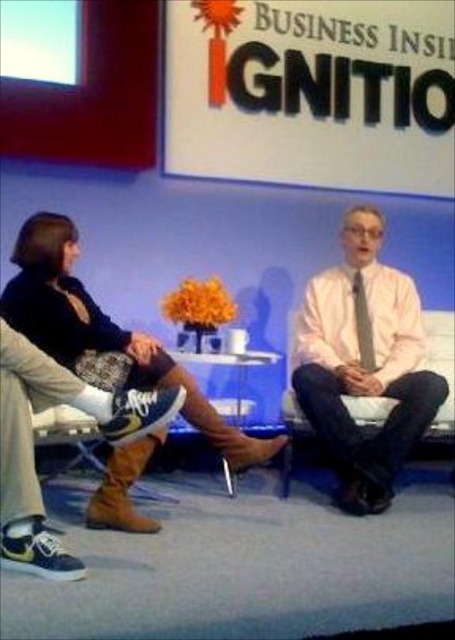
Does pink satin shirt at center appear on the right side of brown suede boots at lower center?

Correct, you'll find pink satin shirt at center to the right of brown suede boots at lower center.

Locate an element on the screen. The height and width of the screenshot is (640, 455). pink satin shirt at center is located at coordinates (364, 364).

Is point (80, 396) less distant than point (365, 355)?

Yes, it is in front of point (365, 355).

Is brown suede boot at lower left wider than silky white tie at center?

Correct, the width of brown suede boot at lower left exceeds that of silky white tie at center.

Between point (64, 554) and point (358, 346), which one is positioned behind?

Point (358, 346)

Identify the location of brown suede boot at lower left. The image size is (455, 640). (34, 451).

The image size is (455, 640). What do you see at coordinates (364, 364) in the screenshot?
I see `pink satin shirt at center` at bounding box center [364, 364].

Is pink satin shirt at center to the right of brown suede boot at lower left from the viewer's perspective?

Correct, you'll find pink satin shirt at center to the right of brown suede boot at lower left.

This screenshot has width=455, height=640. Describe the element at coordinates (364, 364) in the screenshot. I see `pink satin shirt at center` at that location.

The width and height of the screenshot is (455, 640). Find the location of `pink satin shirt at center`. pink satin shirt at center is located at coordinates (364, 364).